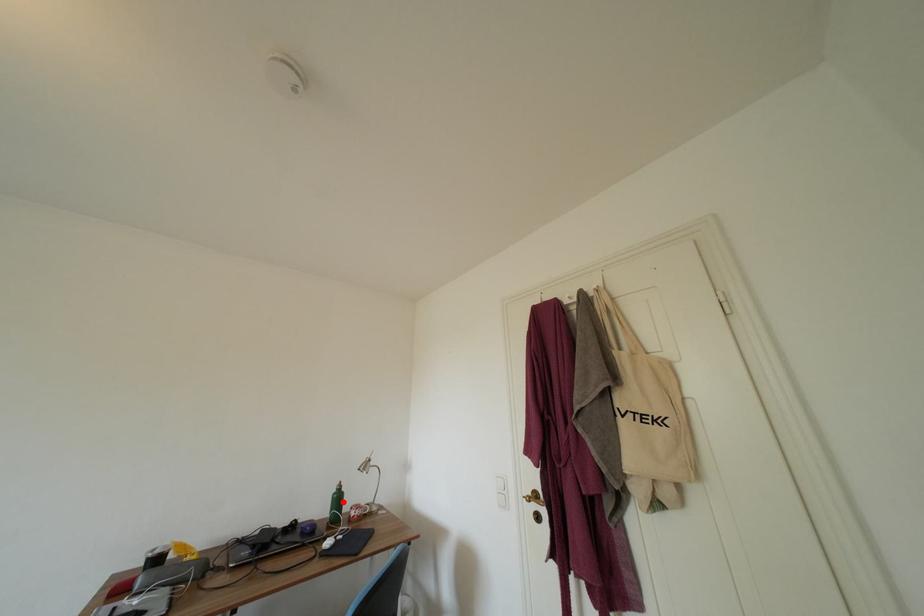
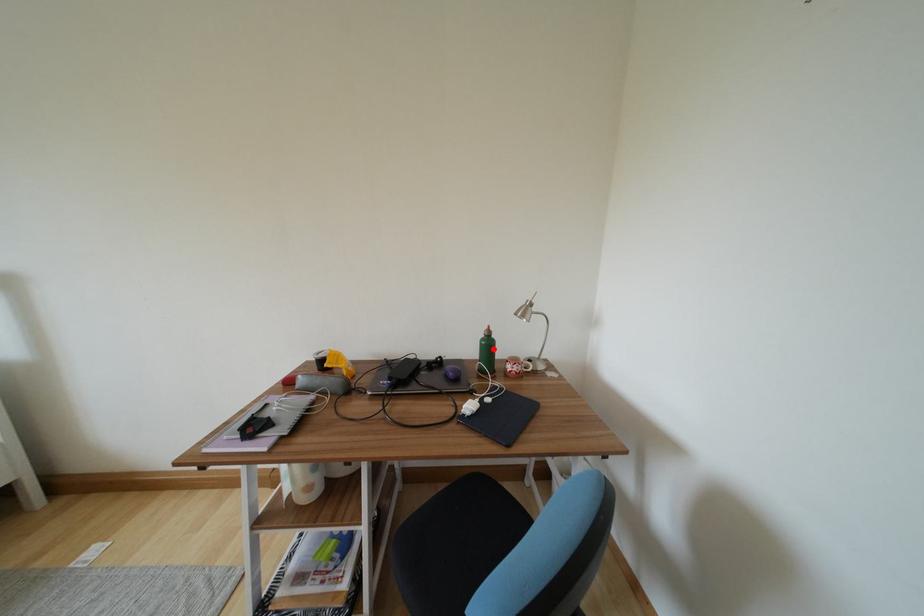
I am providing you with two images of the same scene from different viewpoints. A red point is marked on the first image and another point is marked on the second image. Do the highlighted points in image1 and image2 indicate the same real-world spot?

Yes